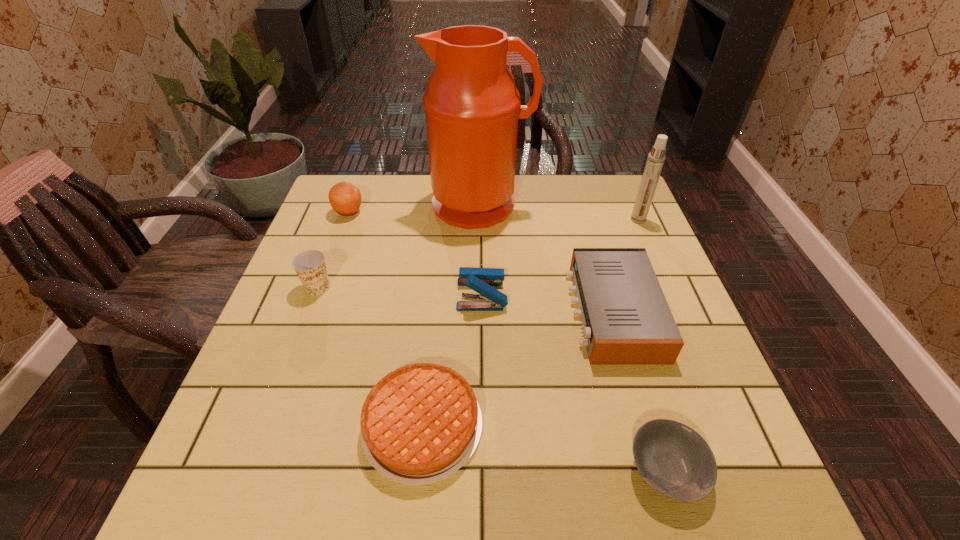
This screenshot has height=540, width=960. I want to click on free area in between the bowl and the stapler, so click(x=574, y=382).

This screenshot has height=540, width=960. Identify the location of vacant area between the stapler and the bowl. (574, 382).

You are a GUI agent. You are given a task and a screenshot of the screen. Output one action in this format:
    pyautogui.click(x=<x>, y=<y>)
    Task: Click on the free space between the tallest object and the Dixie cup
    This screenshot has height=540, width=960.
    Given the screenshot: What is the action you would take?
    pyautogui.click(x=399, y=246)

This screenshot has width=960, height=540. Identify the location of vacant space in between the sixth tallest object and the pie. (517, 369).

I want to click on free spot between the bowl and the radio receiver, so click(x=639, y=391).

Locate an element on the screen. vacant region between the sixth tallest object and the stapler is located at coordinates (547, 303).

Identify which object is located as the fifth nearest to the tallest object. Please provide its 2D coordinates. Your answer should be formatted as a tuple, i.e. [(x, y)], where the tuple contains the x and y coordinates of a point satisfying the conditions above.

[(654, 164)]

Locate which object is the second closest to the seventh shortest object. Please provide its 2D coordinates. Your answer should be formatted as a tuple, i.e. [(x, y)], where the tuple contains the x and y coordinates of a point satisfying the conditions above.

[(472, 107)]

Where is `vacant space that satisfies the following two spatial constraints: 1. from the spout of the stapler; 2. on the left side of the water jug`? vacant space that satisfies the following two spatial constraints: 1. from the spout of the stapler; 2. on the left side of the water jug is located at coordinates (480, 294).

Find the location of `free point that satisfies the following two spatial constraints: 1. from the spout of the water jug; 2. on the left side of the stapler`. free point that satisfies the following two spatial constraints: 1. from the spout of the water jug; 2. on the left side of the stapler is located at coordinates (480, 294).